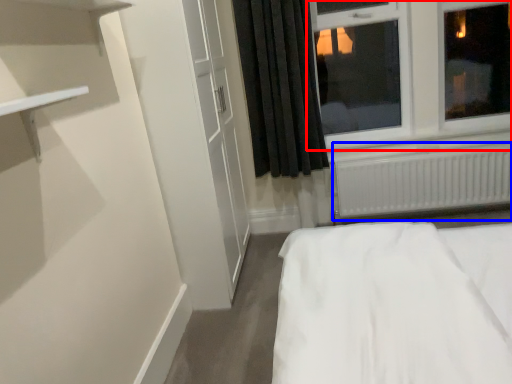
Question: Which of the following is the farthest to the observer, window (highlighted by a red box) or radiator (highlighted by a blue box)?

Choices:
 (A) window
 (B) radiator

Answer: (B)